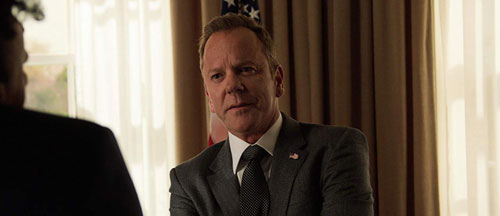
Where is `beige curtains`? beige curtains is located at coordinates (314, 53).